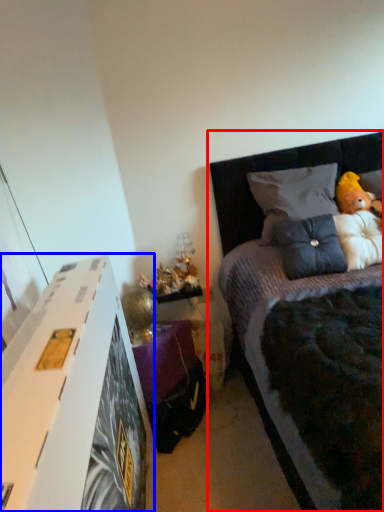
Question: Which object appears farthest to the camera in this image, bed (highlighted by a red box) or nightstand (highlighted by a blue box)?

Choices:
 (A) bed
 (B) nightstand

Answer: (B)